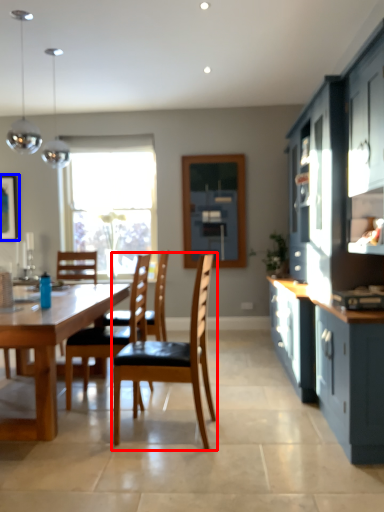
Question: Which object appears closest to the camera in this image, chair (highlighted by a red box) or picture frame (highlighted by a blue box)?

Choices:
 (A) chair
 (B) picture frame

Answer: (A)